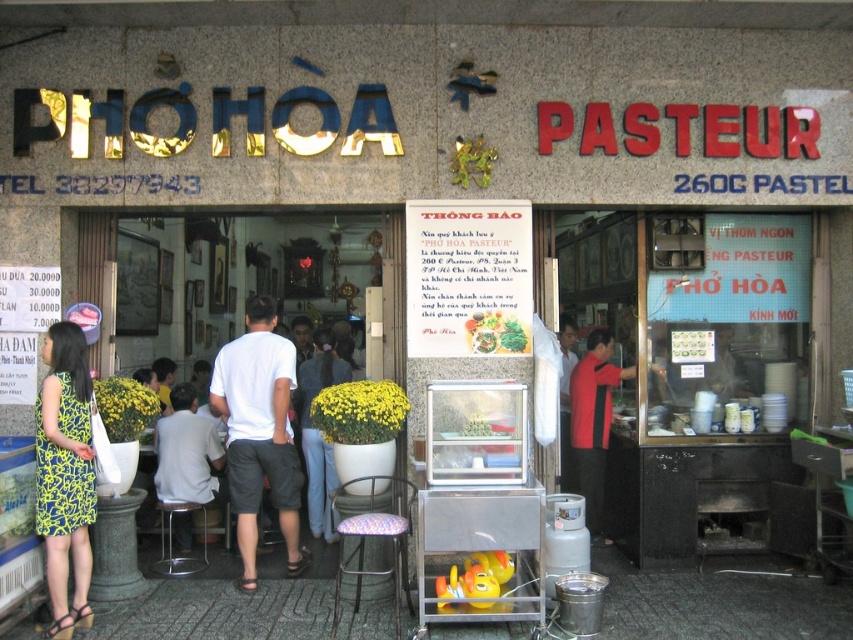
Question: Can you confirm if blue jeans at center is positioned to the left of green leafy vegetables at center?

Choices:
 (A) yes
 (B) no

Answer: (A)

Question: Which point is closer to the camera?

Choices:
 (A) (170, 531)
 (B) (498, 332)
 (C) (48, 452)
 (D) (287, 396)

Answer: (C)

Question: Which point is farther to the camera?

Choices:
 (A) (178, 570)
 (B) (578, 388)

Answer: (B)

Question: Is yellow-green printed dress at lower left smaller than metallic stool at lower center?

Choices:
 (A) no
 (B) yes

Answer: (B)

Question: Which of the following is the farthest from the observer?

Choices:
 (A) (195, 509)
 (B) (572, 371)
 (C) (355, 531)

Answer: (B)

Question: Does yellow-green printed dress at lower left have a smaller size compared to floral fabric stool at center?

Choices:
 (A) no
 (B) yes

Answer: (B)